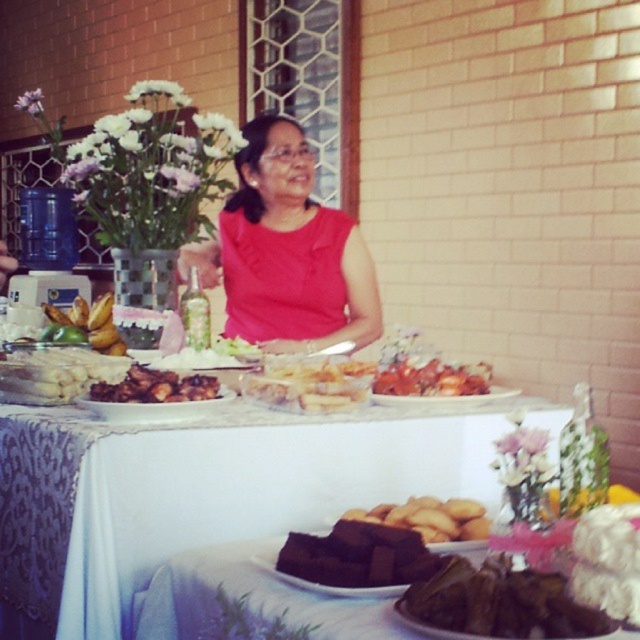
Question: Is white glossy cake at left smaller than brown matte chicken at center?

Choices:
 (A) no
 (B) yes

Answer: (A)

Question: Is brown matte cake at lower center wider than green matte bananas at center?

Choices:
 (A) no
 (B) yes

Answer: (A)

Question: Estimate the real-world distances between objects in this image. Which object is closer to the green matte bananas at center?

Choices:
 (A) white creamy cake at center
 (B) brown matte cake at lower center
 (C) white lace tablecloth at lower center

Answer: (A)

Question: From the image, what is the correct spatial relationship of brown matte cake at lower center in relation to white creamy cake at center?

Choices:
 (A) right
 (B) left

Answer: (A)

Question: Which point is closer to the camera?

Choices:
 (A) pos(288,192)
 (B) pos(106,328)
 (C) pos(364,586)
 (D) pos(204,358)

Answer: (C)

Question: Among these points, which one is farthest from the camera?

Choices:
 (A) (378, 403)
 (B) (228, 454)

Answer: (A)